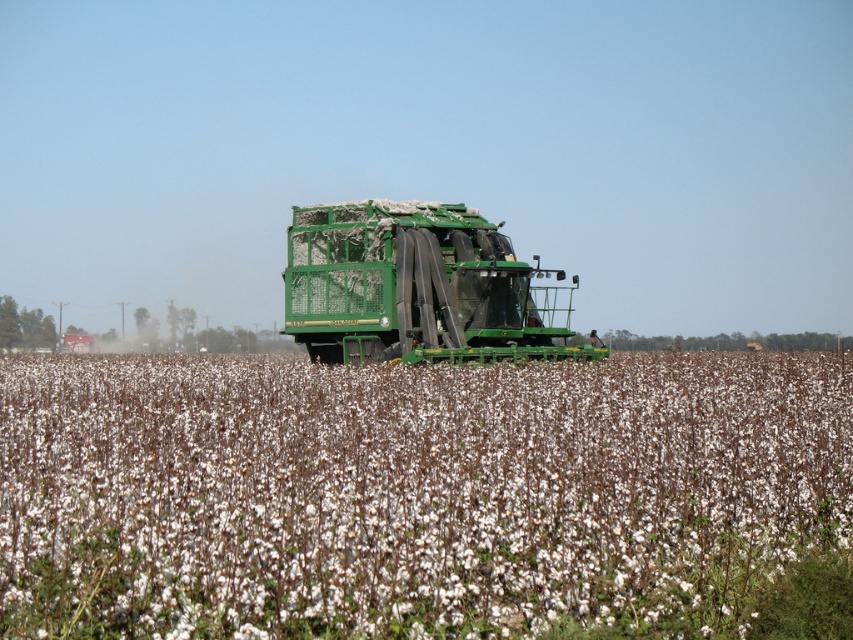
You are a farmer standing at the edge of the field. You need to check the cotton being harvested and the truck ready for transport. Which object, the white fluffy cotton at center or the green matte trailer truck at center, is nearer to you?

The white fluffy cotton at center is closer to the viewer than the green matte trailer truck at center, so the white fluffy cotton at center is nearer to you.

You are a farmer checking the harvest progress. You see the white fluffy cotton at center and the green matte trailer truck at center. Which one is wider?

The white fluffy cotton at center is wider than the green matte trailer truck at center according to the description.

You are a farmer checking the harvest progress. You notice the white fluffy cotton at center and the green matte trailer truck at center. Which one is positioned lower in the scene?

The white fluffy cotton at center is below the green matte trailer truck at center, so the white fluffy cotton at center is positioned lower in the scene.